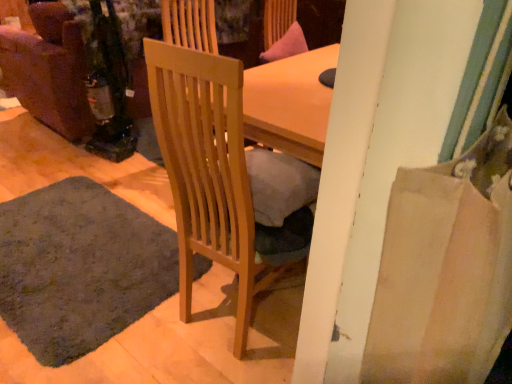
Question: In terms of size, does dark gray carpet at lower left appear bigger or smaller than light wood chair at center?

Choices:
 (A) big
 (B) small

Answer: (B)

Question: Is dark gray carpet at lower left spatially inside light wood chair at center, or outside of it?

Choices:
 (A) inside
 (B) outside

Answer: (B)

Question: In the image, is dark gray carpet at lower left positioned in front of or behind light wood chair at center?

Choices:
 (A) front
 (B) behind

Answer: (B)

Question: Considering the positions of point (159, 130) and point (14, 226), is point (159, 130) closer or farther from the camera than point (14, 226)?

Choices:
 (A) closer
 (B) farther

Answer: (A)

Question: Based on their positions, is light wood chair at center located to the left or right of dark gray carpet at lower left?

Choices:
 (A) right
 (B) left

Answer: (A)

Question: From a real-world perspective, is light wood chair at center above or below dark gray carpet at lower left?

Choices:
 (A) below
 (B) above

Answer: (B)

Question: Is light wood chair at center taller or shorter than dark gray carpet at lower left?

Choices:
 (A) tall
 (B) short

Answer: (A)